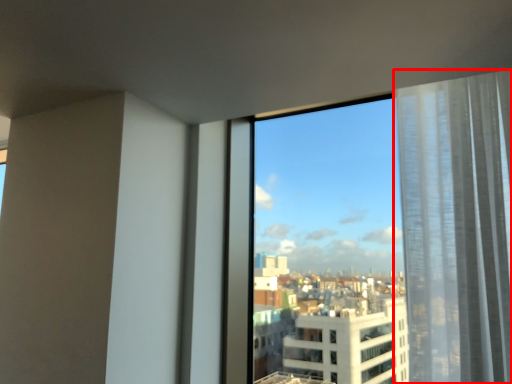
Question: From the image's perspective, considering the relative positions of curtain (annotated by the red box) and window in the image provided, where is curtain (annotated by the red box) located with respect to the staircase?

Choices:
 (A) above
 (B) below

Answer: (A)